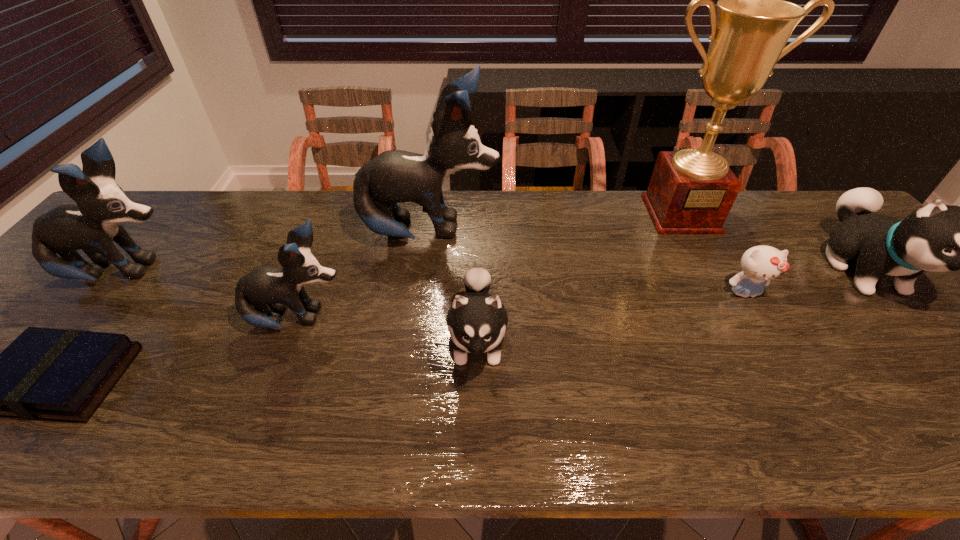
At what (x,y) coordinates should I click in order to perform the action: click on free spot that satisfies the following two spatial constraints: 1. on the plaque of the tallest object; 2. on the front-facing side of the second tallest object. Please return your answer as a coordinate pair (x, y). Looking at the image, I should click on (690, 233).

This screenshot has width=960, height=540. Find the location of `free space that satisfies the following two spatial constraints: 1. on the front-facing side of the kitten; 2. on the front-facing side of the nearest black puppy`. free space that satisfies the following two spatial constraints: 1. on the front-facing side of the kitten; 2. on the front-facing side of the nearest black puppy is located at coordinates (760, 320).